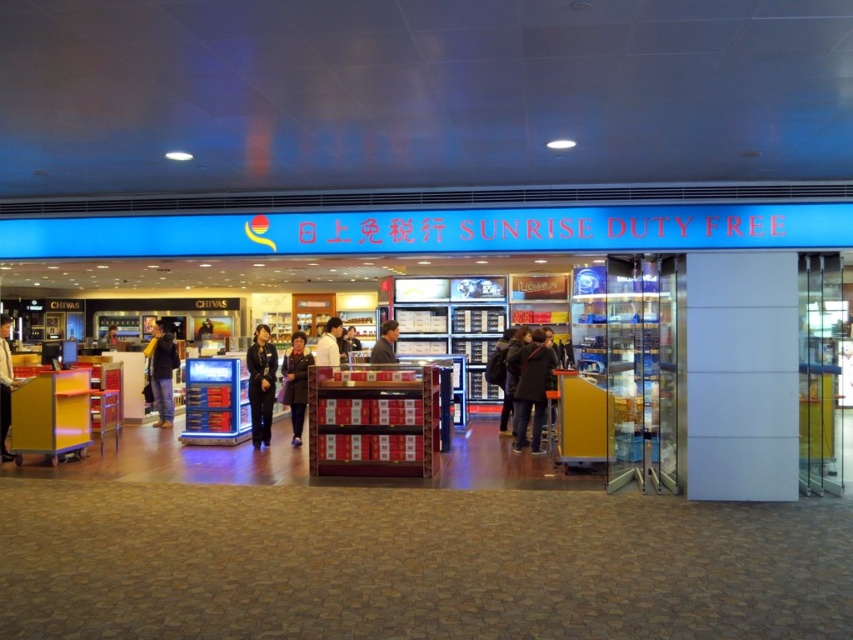
You are a customer standing at the entrance of the Sunrise Duty Free shop. You notice the blue glossy signboard at center and the white shirt at center. Which object is nearer to you?

The blue glossy signboard at center is closer to the viewer than the white shirt at center.

You are a customer entering the Sunrise Duty Free shop and notice a dark gray coat at center and a white shirt at center. Which item is closer to the floor?

The dark gray coat at center is positioned under the white shirt at center, so it is closer to the floor.

You are a customer entering the Sunrise Duty Free shop. You notice a blue glossy signboard at center and a white shirt at center. Which object is bigger in size?

The blue glossy signboard at center has a larger size compared to the white shirt at center.